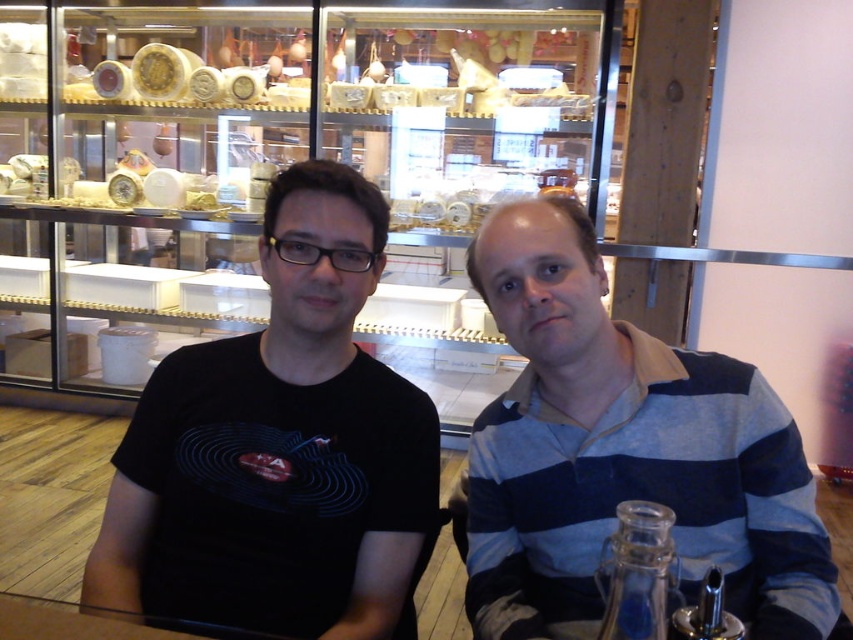
Looking at this image, you are a photographer trying to capture a group photo of the two people in the image. The black matte shirt at center and the blue striped shirt at center are seated side by side. Considering their heights, which person should you position closer to the camera to ensure both are fully visible in the photo?

The black matte shirt at center is much taller than the blue striped shirt at center, so positioning the blue striped shirt at center closer to the camera will help ensure both are fully visible in the photo.